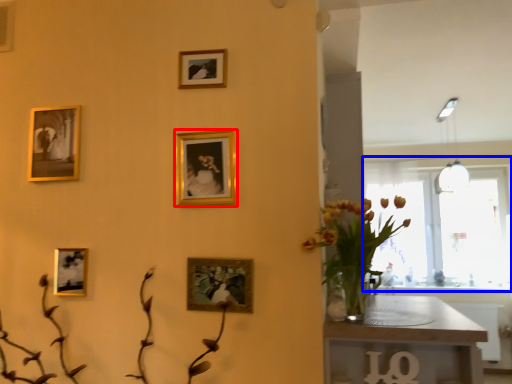
Question: Which point is further to the camera, picture frame (highlighted by a red box) or window (highlighted by a blue box)?

Choices:
 (A) picture frame
 (B) window

Answer: (B)